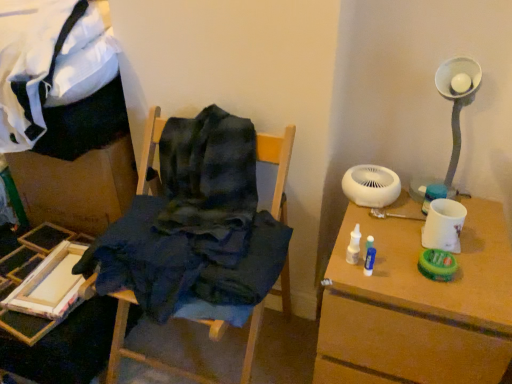
Question: Could dark blue fabric at center, which is counted as the 2th furniture, starting from the left, be considered to be inside white matte table at right?

Choices:
 (A) no
 (B) yes

Answer: (A)

Question: Is the depth of white matte table at right greater than that of dark blue fabric at center, which is counted as the 2th furniture, starting from the left?

Choices:
 (A) no
 (B) yes

Answer: (B)

Question: Considering the relative sizes of white matte table at right and dark blue fabric at center, which is counted as the 2th furniture, starting from the left, in the image provided, is white matte table at right taller than dark blue fabric at center, which is counted as the 2th furniture, starting from the left,?

Choices:
 (A) yes
 (B) no

Answer: (B)

Question: Is white matte table at right smaller than dark blue fabric at center, which is counted as the 2th furniture, starting from the left?

Choices:
 (A) no
 (B) yes

Answer: (B)

Question: Is white matte table at right positioned beyond the bounds of dark blue fabric at center, which is counted as the 2th furniture, starting from the left?

Choices:
 (A) no
 (B) yes

Answer: (B)

Question: Relative to white matte table at right, is dark blue fabric at center, the 1th furniture when ordered from right to left, in front or behind?

Choices:
 (A) behind
 (B) front

Answer: (B)

Question: Is point (278, 152) closer or farther from the camera than point (454, 349)?

Choices:
 (A) farther
 (B) closer

Answer: (A)

Question: From their relative heights in the image, would you say dark blue fabric at center, the 1th furniture when ordered from right to left, is taller or shorter than white matte table at right?

Choices:
 (A) tall
 (B) short

Answer: (A)

Question: Would you say dark blue fabric at center, the 1th furniture when ordered from right to left, is inside or outside white matte table at right?

Choices:
 (A) inside
 (B) outside

Answer: (B)

Question: From the image's perspective, relative to white matte mechanical fan at upper right, is wooden paint tray at lower left, which ranks as the 2th furniture in right-to-left order, above or below?

Choices:
 (A) above
 (B) below

Answer: (B)

Question: From a real-world perspective, is wooden paint tray at lower left, which ranks as the 2th furniture in right-to-left order, physically located above or below white matte mechanical fan at upper right?

Choices:
 (A) above
 (B) below

Answer: (B)

Question: Is wooden paint tray at lower left, the first furniture in the left-to-right sequence, bigger or smaller than white matte mechanical fan at upper right?

Choices:
 (A) small
 (B) big

Answer: (B)

Question: Considering the relative positions of wooden paint tray at lower left, the first furniture in the left-to-right sequence, and white matte mechanical fan at upper right in the image provided, is wooden paint tray at lower left, the first furniture in the left-to-right sequence, to the left or to the right of white matte mechanical fan at upper right?

Choices:
 (A) right
 (B) left

Answer: (B)

Question: Is dark blue fabric at center, which is counted as the 2th furniture, starting from the left, inside the boundaries of wooden paint tray at lower left, which ranks as the 2th furniture in right-to-left order, or outside?

Choices:
 (A) inside
 (B) outside

Answer: (B)

Question: Relative to wooden paint tray at lower left, the first furniture in the left-to-right sequence, is dark blue fabric at center, the 1th furniture when ordered from right to left, in front or behind?

Choices:
 (A) front
 (B) behind

Answer: (A)